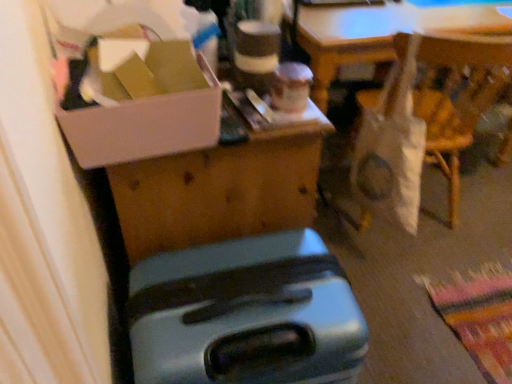
Question: Is white cardboard box at upper left inside or outside of metallic suitcase at lower center?

Choices:
 (A) inside
 (B) outside

Answer: (B)

Question: Is white cardboard box at upper left in front of or behind metallic suitcase at lower center in the image?

Choices:
 (A) behind
 (B) front

Answer: (A)

Question: Which of these objects is positioned closest to the white fabric bag at right?

Choices:
 (A) metallic suitcase at lower center
 (B) white cardboard box at upper left

Answer: (A)

Question: Based on their relative distances, which object is nearer to the metallic suitcase at lower center?

Choices:
 (A) white cardboard box at upper left
 (B) white fabric bag at right

Answer: (A)